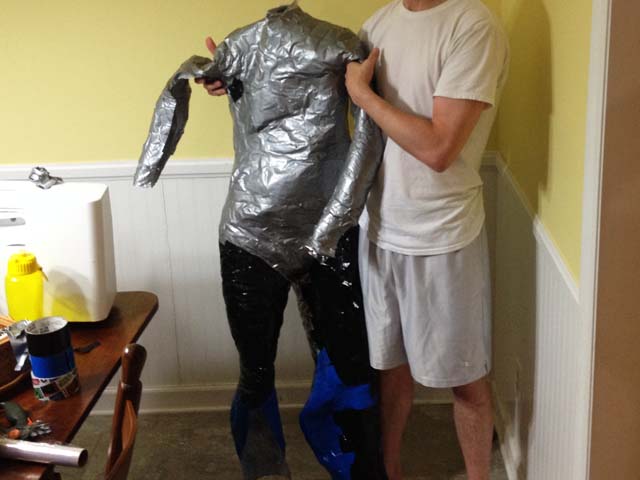
Where is `roll of blue tape`? roll of blue tape is located at coordinates (52, 361).